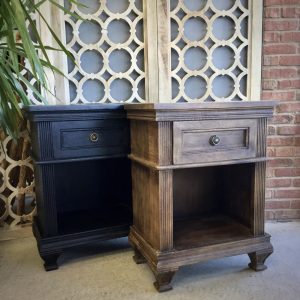
This screenshot has width=300, height=300. What are the coordinates of `drawer` in the screenshot? It's located at (236, 157).